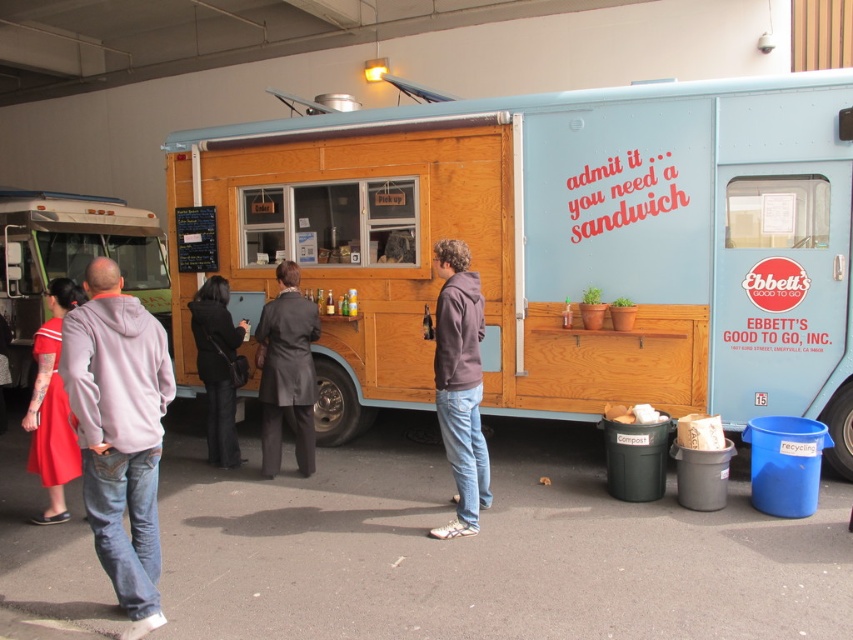
Question: Among these points, which one is farthest from the camera?

Choices:
 (A) (68, 448)
 (B) (679, 413)

Answer: (B)

Question: Can you confirm if matte brown hoodie at center is thinner than black leather jacket at center?

Choices:
 (A) no
 (B) yes

Answer: (B)

Question: Does wooden food truck at center have a greater width compared to gray hoodie at center?

Choices:
 (A) yes
 (B) no

Answer: (A)

Question: Which object is farther from the camera taking this photo?

Choices:
 (A) matte brown hoodie at center
 (B) dark gray suit at center

Answer: (B)

Question: Which of the following is the farthest from the observer?

Choices:
 (A) (56, 208)
 (B) (126, 634)
 (C) (44, 323)
 (D) (604, 227)

Answer: (A)

Question: Is gray hoodie at center positioned in front of matte red dress at lower left?

Choices:
 (A) no
 (B) yes

Answer: (B)